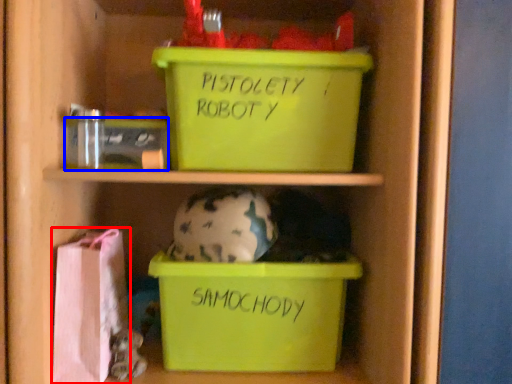
Question: Which object appears closest to the camera in this image, material (highlighted by a red box) or storage box (highlighted by a blue box)?

Choices:
 (A) material
 (B) storage box

Answer: (A)